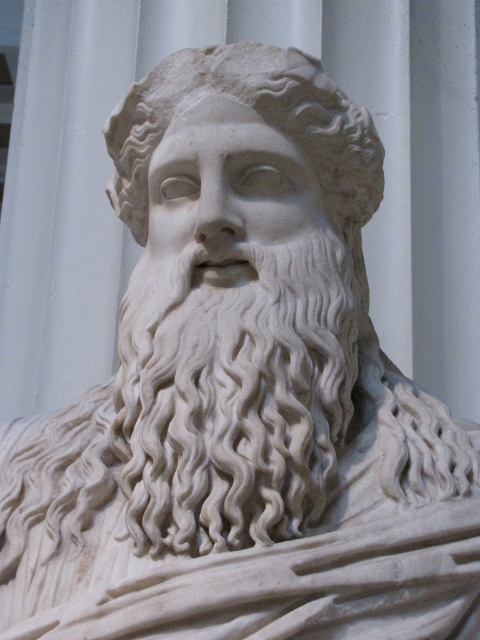
You are an art conservator examining the marble bust sculpture. You notice two points on the sculpture labeled as point 1 at coordinates (228,291) and point 2 at coordinates (181,52). Which point is positioned closer to your viewpoint?

Point 1 at coordinates (228,291) is closer to the viewer than point 2 at coordinates (181,52).